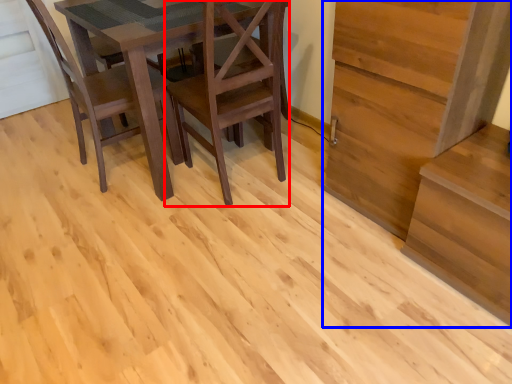
Question: Which object appears farthest to the camera in this image, chair (highlighted by a red box) or stairwell (highlighted by a blue box)?

Choices:
 (A) chair
 (B) stairwell

Answer: (A)